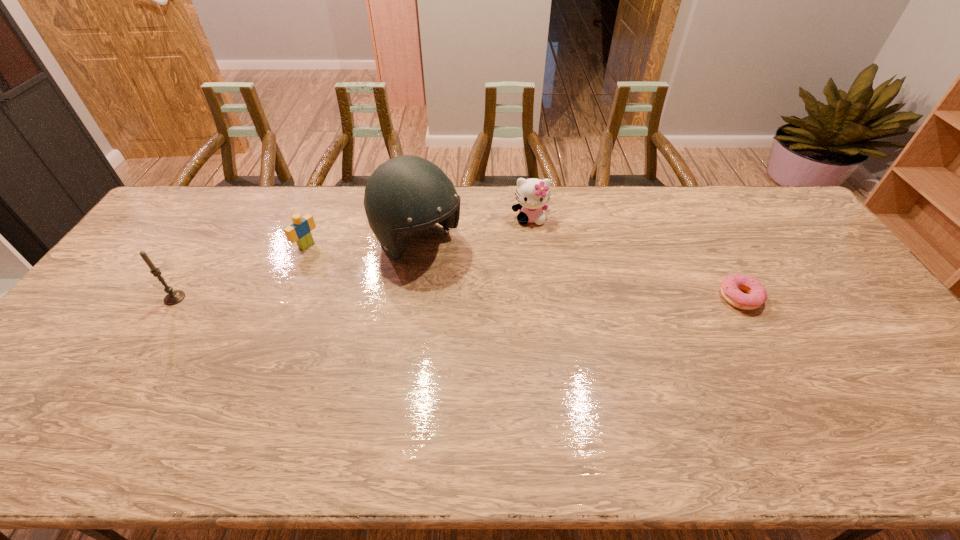
At what (x,y) coordinates should I click in order to perform the action: click on vacant spot on the desktop that is between the candle and the rightmost object and is positioned on the face of the Lego. Please return your answer as a coordinate pair (x, y). The width and height of the screenshot is (960, 540). Looking at the image, I should click on (401, 298).

The height and width of the screenshot is (540, 960). Identify the location of free spot on the desktop that is between the candle and the shortest object and is positioned at the face opening of the tallest object. (484, 298).

At what (x,y) coordinates should I click in order to perform the action: click on vacant spot on the desktop that is between the candle and the rightmost object and is positioned on the front-facing side of the third shortest object. Please return your answer as a coordinate pair (x, y). Looking at the image, I should click on (535, 298).